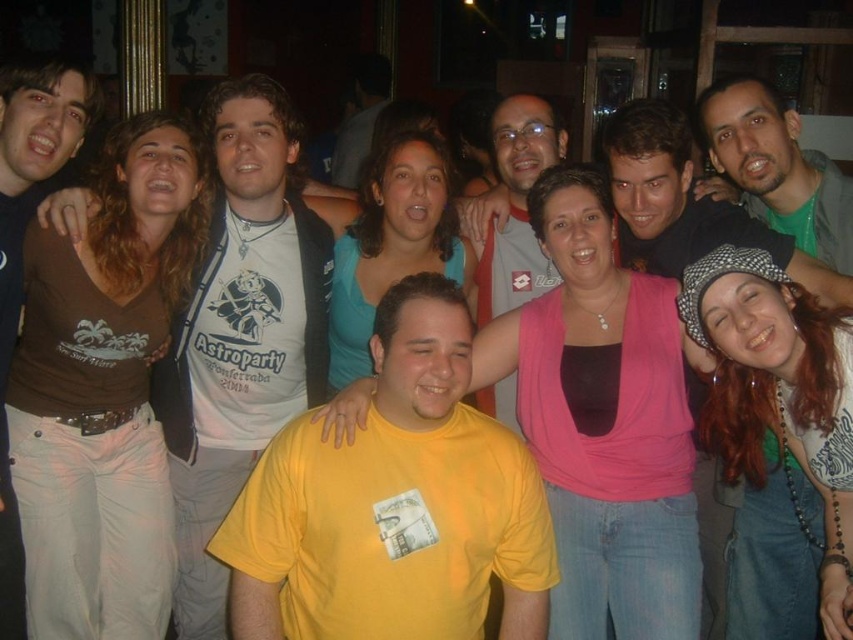
Can you confirm if matte white t-shirt at center is smaller than beige fabric cap at right?

Incorrect, matte white t-shirt at center is not smaller in size than beige fabric cap at right.

Between matte white t-shirt at center and beige fabric cap at right, which one has less height?

beige fabric cap at right

Does point (250, 449) lie in front of point (790, 225)?

That is False.

Find the location of a particular element. The image size is (853, 640). matte white t-shirt at center is located at coordinates (241, 332).

Is matte white t-shirt at center bigger than green t-shirt at center?

Yes.

Is matte white t-shirt at center in front of green t-shirt at center?

No.

Is point (265, 108) farther from viewer compared to point (616, 189)?

No, (265, 108) is in front of (616, 189).

Locate an element on the screen. matte white t-shirt at center is located at coordinates (241, 332).

Which of these two, brown cotton shirt at left or matte gray shirt at center, stands taller?

brown cotton shirt at left

Identify the location of brown cotton shirt at left. (21, 248).